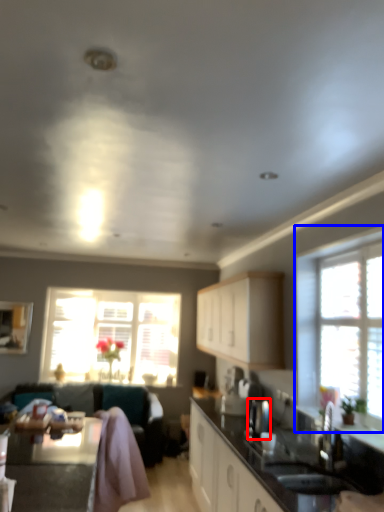
Question: Which object appears closest to the camera in this image, appliance (highlighted by a red box) or window (highlighted by a blue box)?

Choices:
 (A) appliance
 (B) window

Answer: (B)